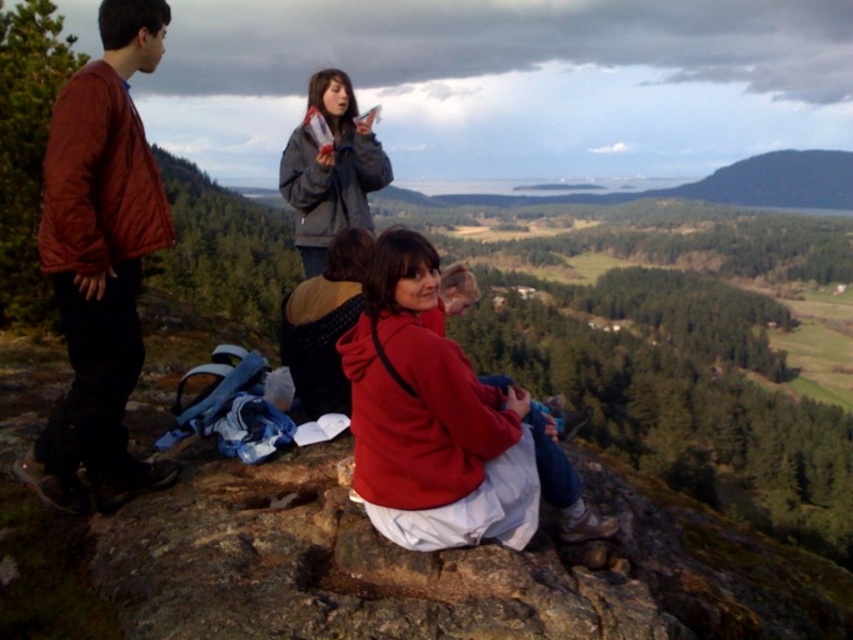
You are standing at the point marked as point (126,52) and want to walk to the point marked as point (352,186). Which direction should you face to move towards your destination?

You should face backward because point (126,52) is in front of point (352,186), so moving backward from point (126,52) will take you toward point (352,186).

You are a photographer trying to capture a group photo of the matte brown jacket at left and the matte red hoodie at center. Since you want to ensure both subjects are visible in the frame, which subject should you position closer to the camera to maintain their visibility?

The matte brown jacket at left has a lesser height compared to the matte red hoodie at center. To ensure both are visible, position the matte brown jacket at left closer to the camera so its smaller size doesn that it won